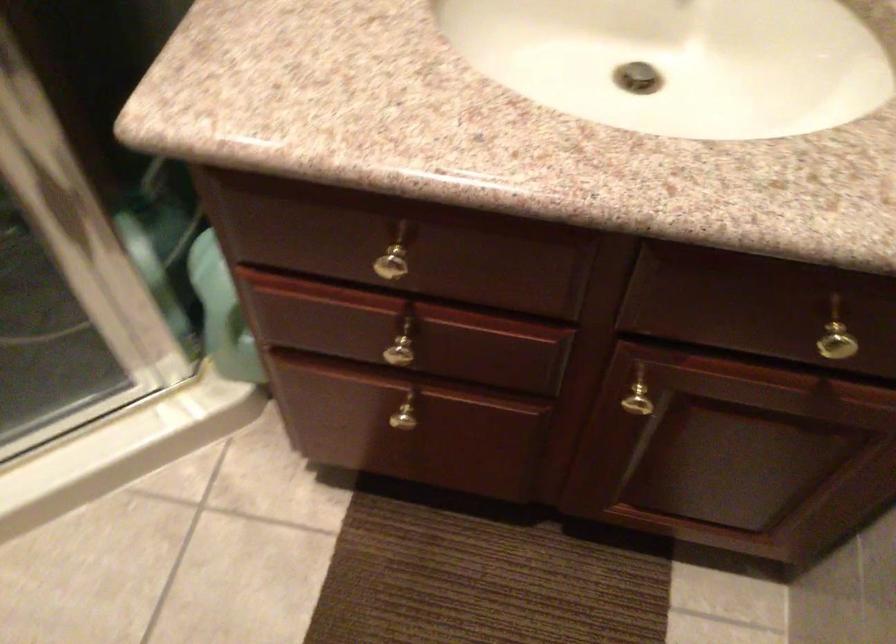
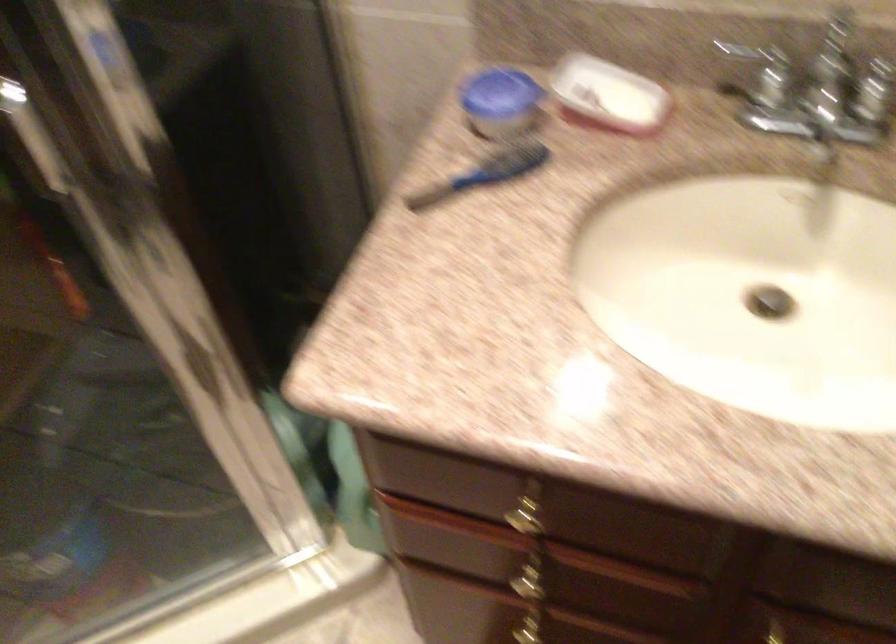
Question: Based on the continuous images, in which direction is the camera rotating? Reply with the corresponding letter.

Choices:
 (A) Left
 (B) Right
 (C) Up
 (D) Down

Answer: (A)